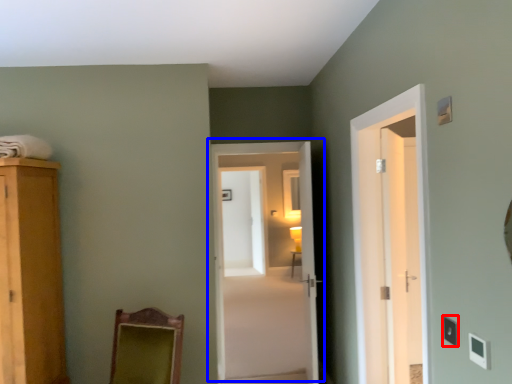
Question: Which object appears farthest to the camera in this image, light switch (highlighted by a red box) or door (highlighted by a blue box)?

Choices:
 (A) light switch
 (B) door

Answer: (B)